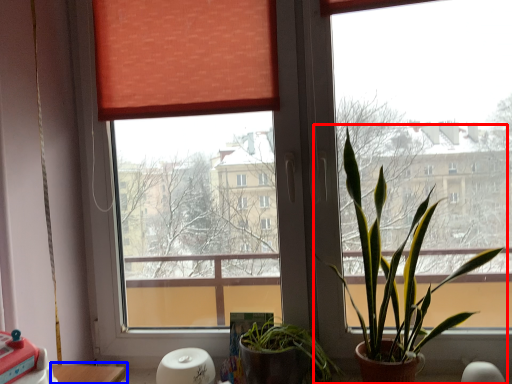
Question: Among these objects, which one is farthest to the camera, houseplant (highlighted by a red box) or table (highlighted by a blue box)?

Choices:
 (A) houseplant
 (B) table

Answer: (B)